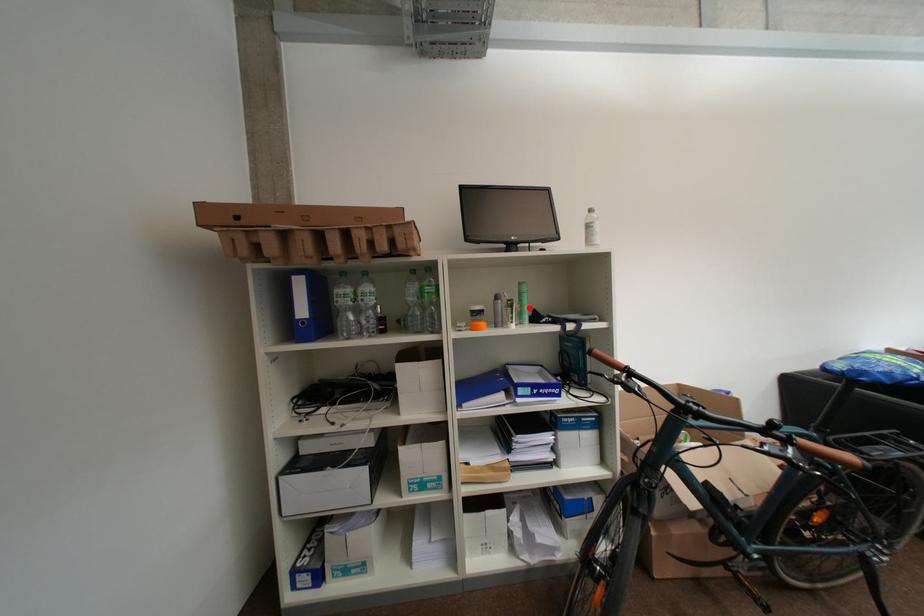
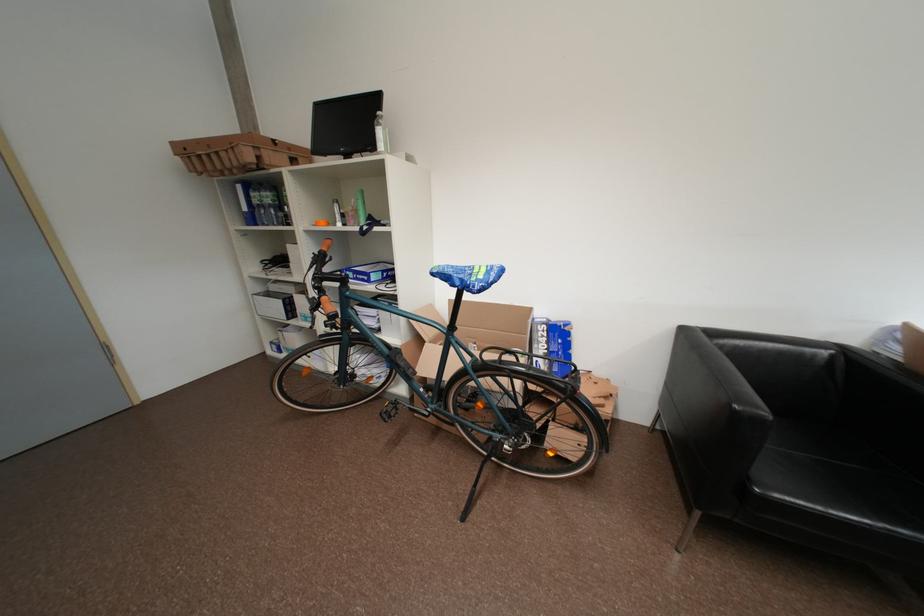
The point at the highlighted location is marked in the first image. Where is the corresponding point in the second image?

(363, 213)